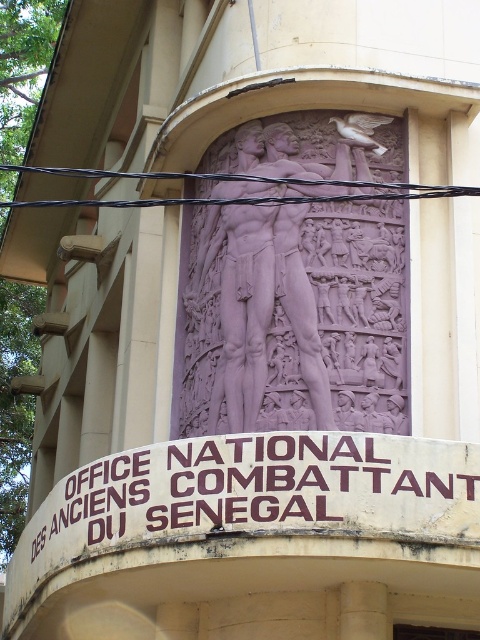
Question: Is purple stone relief at center bigger than brownmaterial/texturesign at center?

Choices:
 (A) no
 (B) yes

Answer: (A)

Question: From the image, what is the correct spatial relationship of purple stone relief at center in relation to brownmaterial/texturesign at center?

Choices:
 (A) right
 (B) left

Answer: (A)

Question: Does purple stone relief at center have a smaller size compared to brownmaterial/texturesign at center?

Choices:
 (A) no
 (B) yes

Answer: (B)

Question: Which object is closer to the camera taking this photo?

Choices:
 (A) purple stone relief at center
 (B) brownmaterial/texturesign at center

Answer: (B)

Question: Which of the following is the farthest from the observer?

Choices:
 (A) brownmaterial/texturesign at center
 (B) purple stone relief at center

Answer: (B)